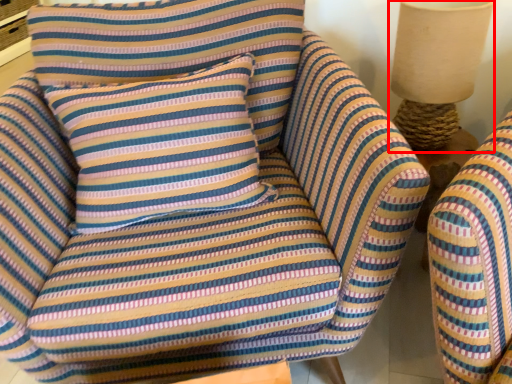
Question: From the image's perspective, what is the correct spatial positioning of table lamp (annotated by the red box) in reference to pillow?

Choices:
 (A) above
 (B) below

Answer: (A)